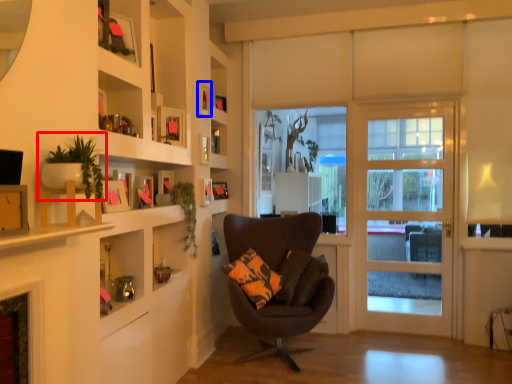
Question: Which point is closer to the camera, houseplant (highlighted by a red box) or picture frame (highlighted by a blue box)?

Choices:
 (A) houseplant
 (B) picture frame

Answer: (A)